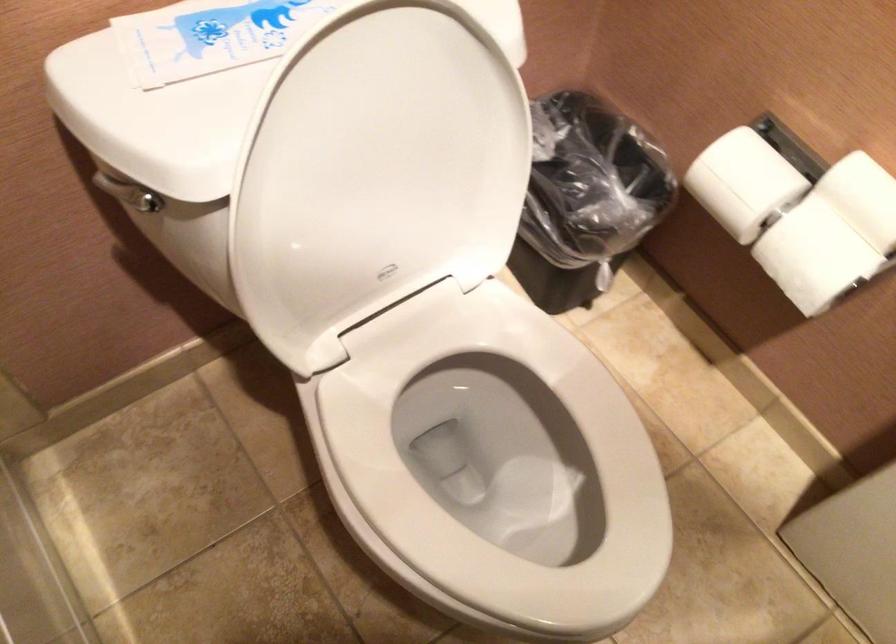
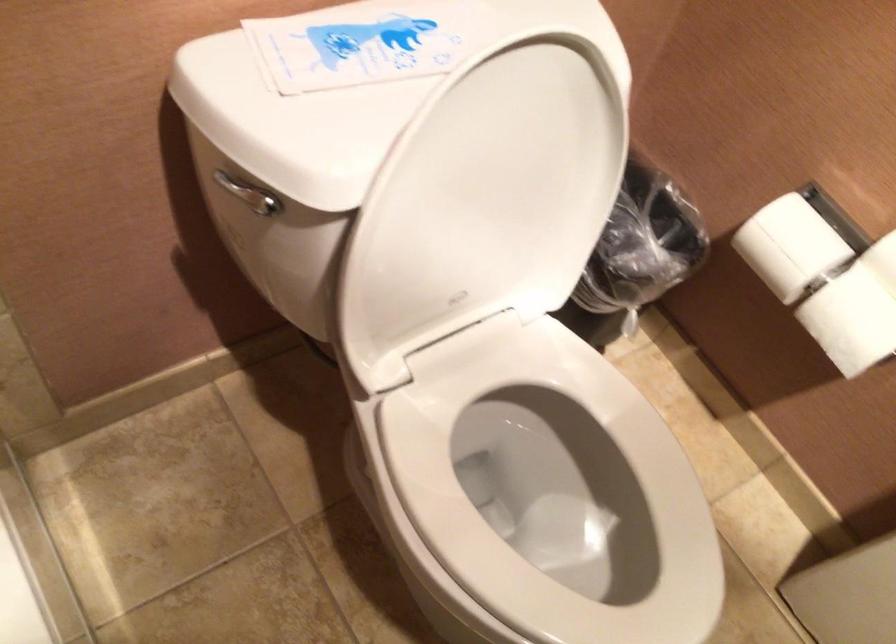
In the second image, find the point that corresponds to (384,174) in the first image.

(484, 204)